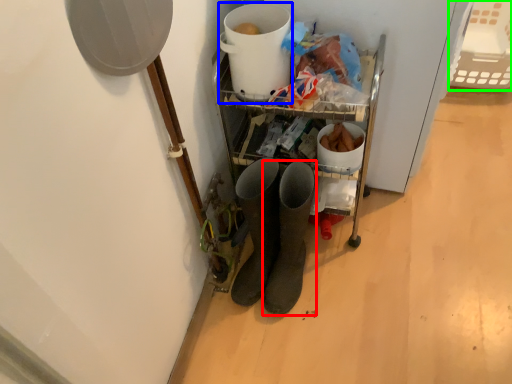
Question: Which object is positioned closest to footwear (highlighted by a red box)? Select from appliance (highlighted by a blue box) and basket (highlighted by a green box).

Choices:
 (A) appliance
 (B) basket

Answer: (A)